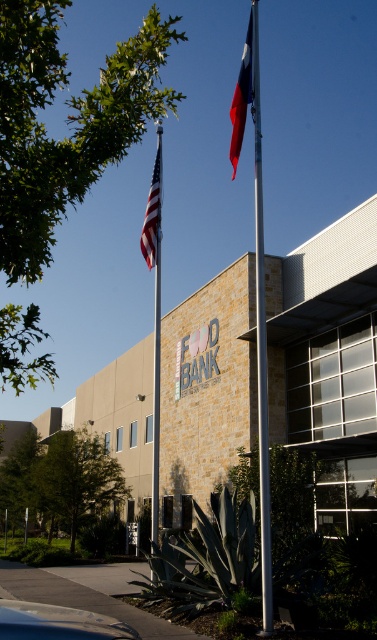
You are driving a car and need to park in front of the Food Bank. The parking spot is directly in front of the silver metallic flag pole at center. Can you park your car there without blocking the metallic silver car at lower left?

The silver metallic flag pole at center is to the right of the metallic silver car at lower left, so parking directly in front of the flag pole would place your car to the right of the existing metallic silver car at lower left. This should be possible without blocking it, provided there is enough space between them.

You are a delivery driver who needs to park your truck near the Food Bank building. The truck requires a parking space that is at least 10 meters long. You see the red fabric flag at upper center and the american flag at upper left. Can you determine if the space between them is long enough for your truck?

The distance between the red fabric flag at upper center and the american flag at upper left is 9.25 meters, which is shorter than the required 10 meters. Therefore, the space between them is not long enough for your truck.

You are driving a car that is 1.8 meters wide and want to park it in the space between the silver metallic flag pole at center and another object. Is there enough space if you align the car with the metallic silver car at lower left?

The silver metallic flag pole at center is wider than the metallic silver car at lower left. Since the car you are driving is 1.8 meters wide, you need to ensure the space between them is at least 1.8 meters. However, the description only mentions the width comparison between the flag pole and the existing car, not the distance between them. Without knowing the exact distance, it is impossible to determine if there is enough space.